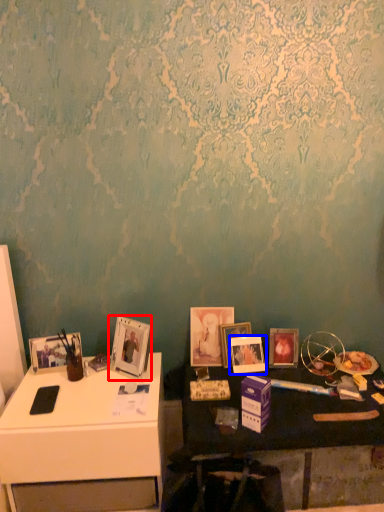
Question: Among these objects, which one is nearest to the camera, picture frame (highlighted by a red box) or picture frame (highlighted by a blue box)?

Choices:
 (A) picture frame
 (B) picture frame

Answer: (A)